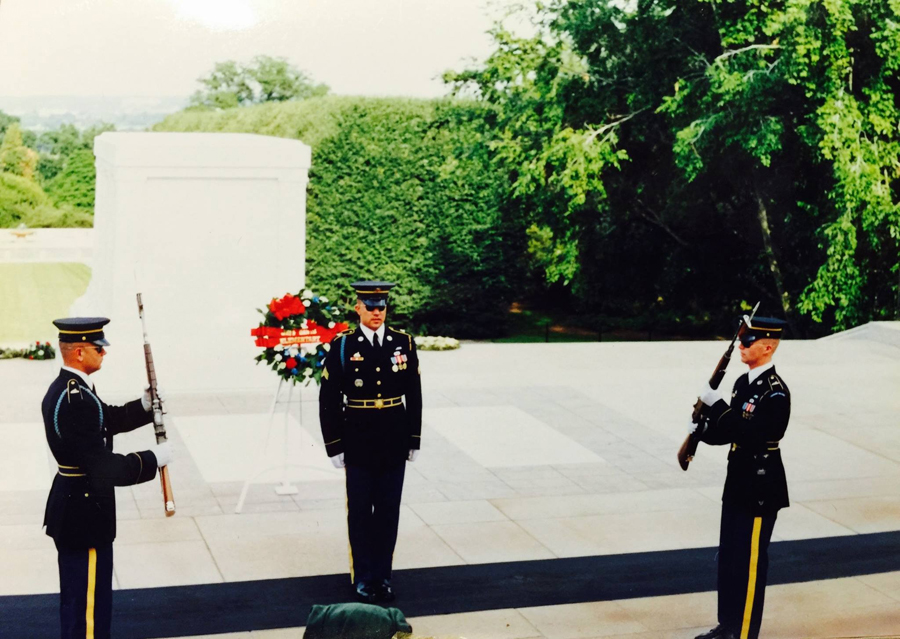
Locate an element on the screen. The image size is (900, 639). wreath is located at coordinates (306, 307).